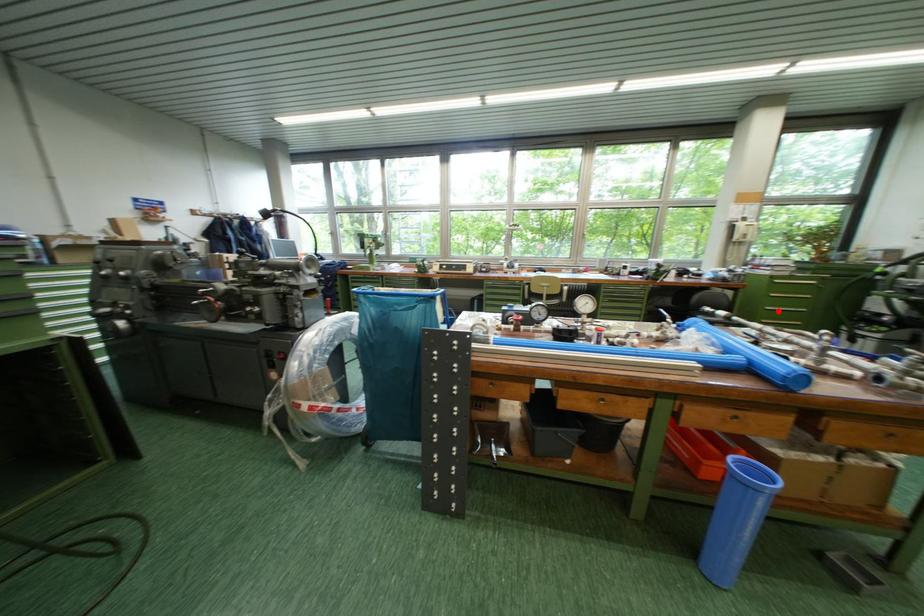
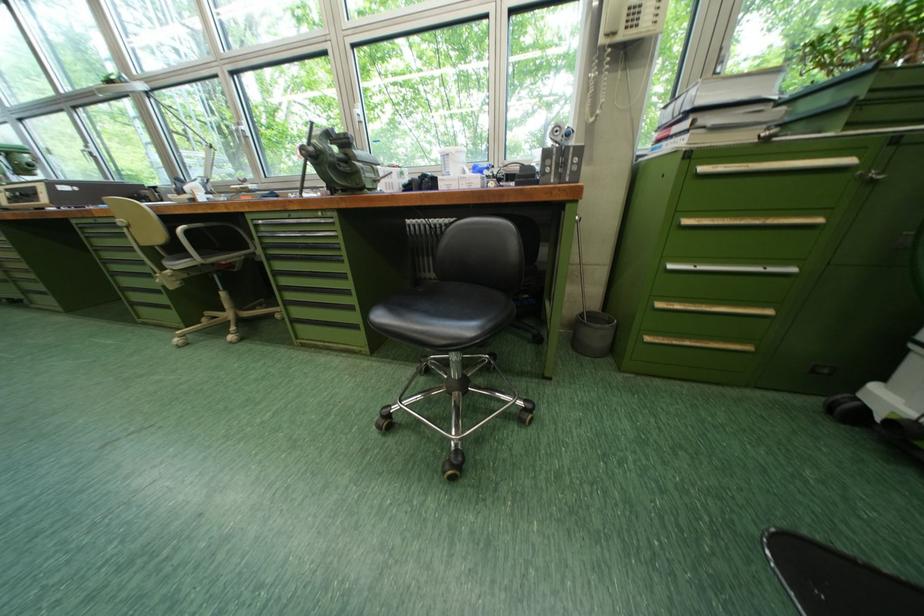
Question: I am providing you with two images of the same scene from different viewpoints. A red point is marked on the first image. At the location where the point appears in image 1, is it still visible in image 2?

Choices:
 (A) Yes
 (B) No

Answer: (A)